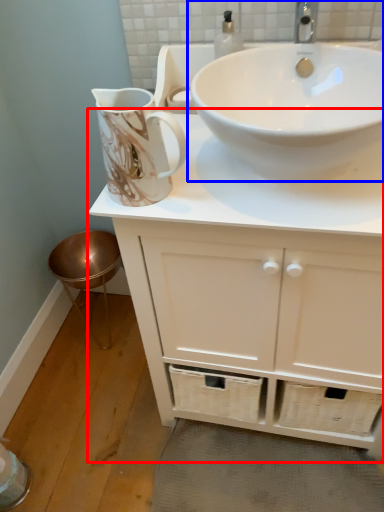
Question: Which object is further to the camera taking this photo, bathroom cabinet (highlighted by a red box) or sink (highlighted by a blue box)?

Choices:
 (A) bathroom cabinet
 (B) sink

Answer: (B)